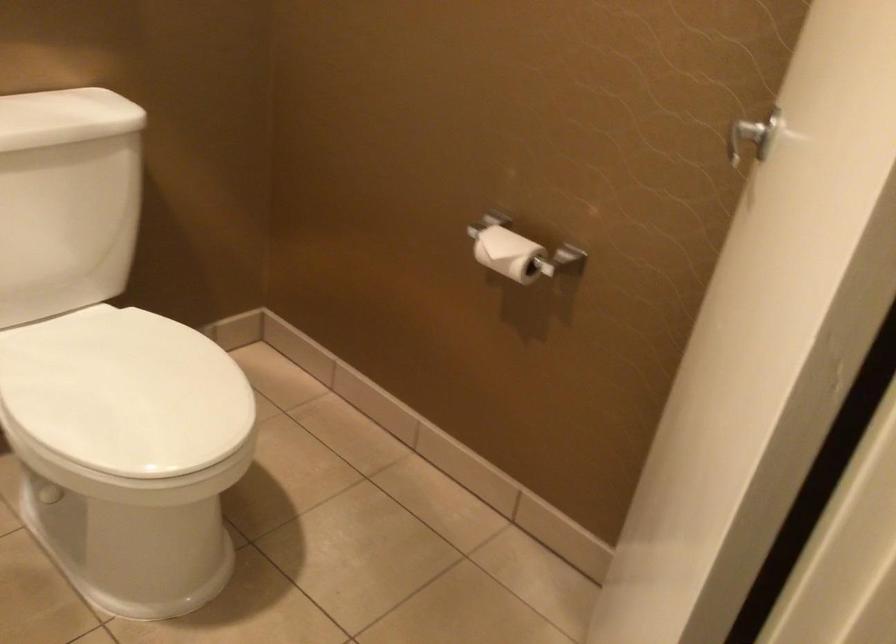
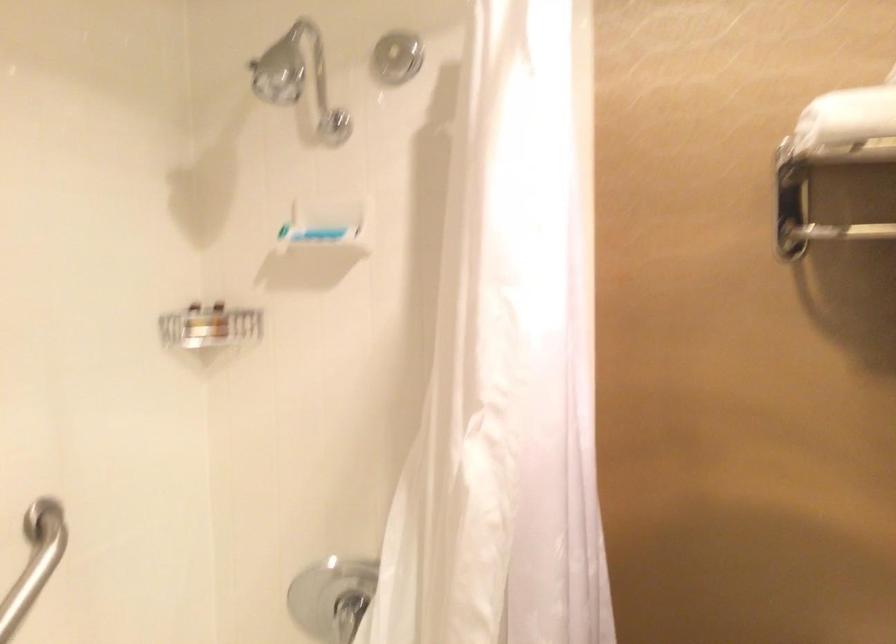
First-person continuous shooting, in which direction is the camera rotating?

The camera's rotation is toward left-up.